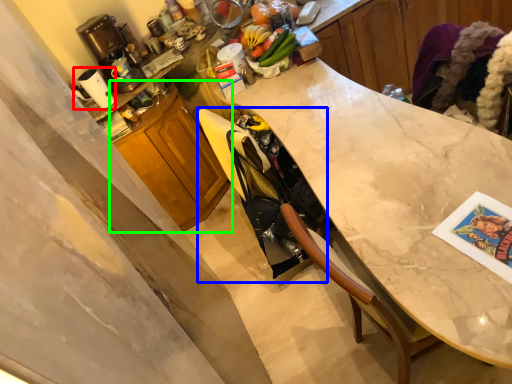
Question: Considering the real-world distances, which object is farthest from appliance (highlighted by a red box)? swivel chair (highlighted by a blue box) or cabinetry (highlighted by a green box)?

Choices:
 (A) swivel chair
 (B) cabinetry

Answer: (A)